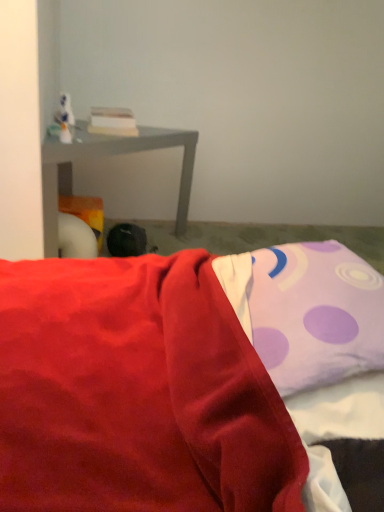
Question: Is matte gray table at left placed right next to black fabric bean bag at center?

Choices:
 (A) no
 (B) yes

Answer: (A)

Question: Does matte gray table at left contain black fabric bean bag at center?

Choices:
 (A) no
 (B) yes

Answer: (B)

Question: Considering the relative positions of matte gray table at left and black fabric bean bag at center in the image provided, is matte gray table at left in front of black fabric bean bag at center?

Choices:
 (A) no
 (B) yes

Answer: (B)

Question: Does matte gray table at left have a greater height compared to black fabric bean bag at center?

Choices:
 (A) yes
 (B) no

Answer: (A)

Question: From a real-world perspective, is matte gray table at left located higher than black fabric bean bag at center?

Choices:
 (A) yes
 (B) no

Answer: (A)

Question: Which is correct: matte gray table at left is inside purple dotted pillow at upper right, or outside of it?

Choices:
 (A) outside
 (B) inside

Answer: (A)

Question: Considering the positions of matte gray table at left and purple dotted pillow at upper right in the image, is matte gray table at left taller or shorter than purple dotted pillow at upper right?

Choices:
 (A) tall
 (B) short

Answer: (A)

Question: Based on their sizes in the image, would you say matte gray table at left is bigger or smaller than purple dotted pillow at upper right?

Choices:
 (A) big
 (B) small

Answer: (A)

Question: From a real-world perspective, is matte gray table at left physically located above or below purple dotted pillow at upper right?

Choices:
 (A) above
 (B) below

Answer: (B)

Question: In terms of height, does black fabric bean bag at center look taller or shorter compared to matte gray table at left?

Choices:
 (A) tall
 (B) short

Answer: (B)

Question: In terms of width, does black fabric bean bag at center look wider or thinner when compared to matte gray table at left?

Choices:
 (A) wide
 (B) thin

Answer: (B)

Question: From a real-world perspective, is black fabric bean bag at center positioned above or below matte gray table at left?

Choices:
 (A) above
 (B) below

Answer: (B)

Question: Is black fabric bean bag at center bigger or smaller than matte gray table at left?

Choices:
 (A) big
 (B) small

Answer: (B)

Question: Is purple dotted pillow at upper right wider or thinner than black fabric bean bag at center?

Choices:
 (A) thin
 (B) wide

Answer: (B)

Question: Is purple dotted pillow at upper right situated inside black fabric bean bag at center or outside?

Choices:
 (A) inside
 (B) outside

Answer: (B)